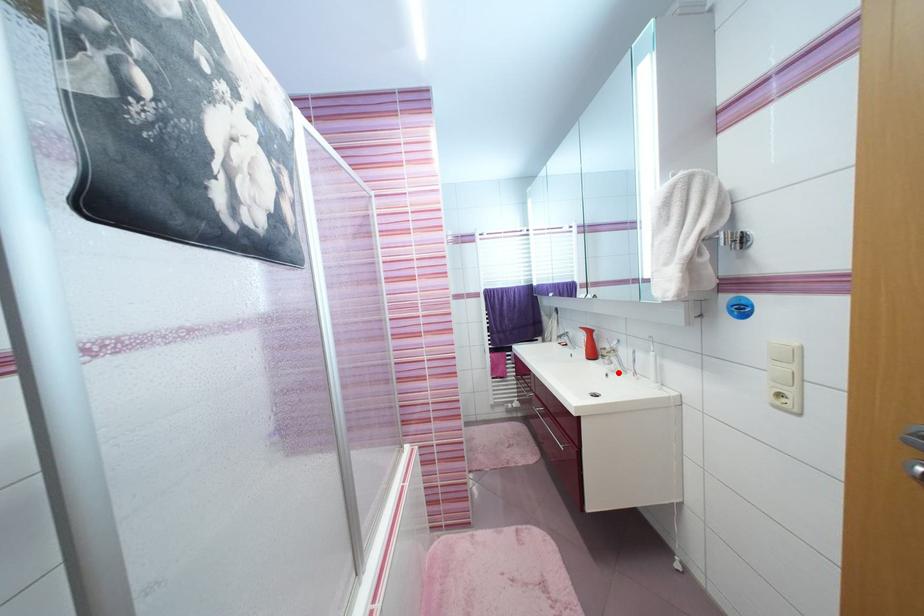
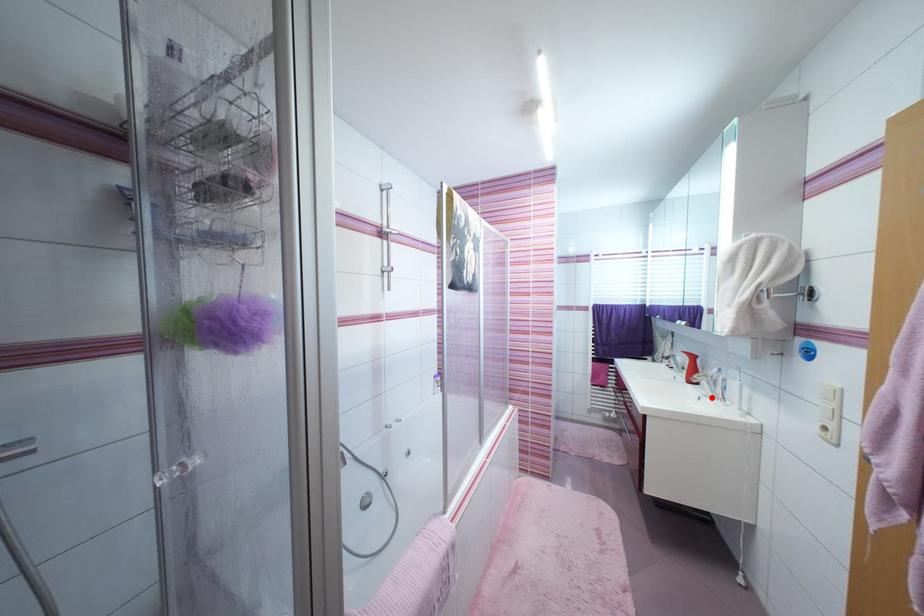
I am providing you with two images of the same scene from different viewpoints. A red point is marked on the first image and another point is marked on the second image. Are the points marked in image1 and image2 representing the same 3D position?

Yes